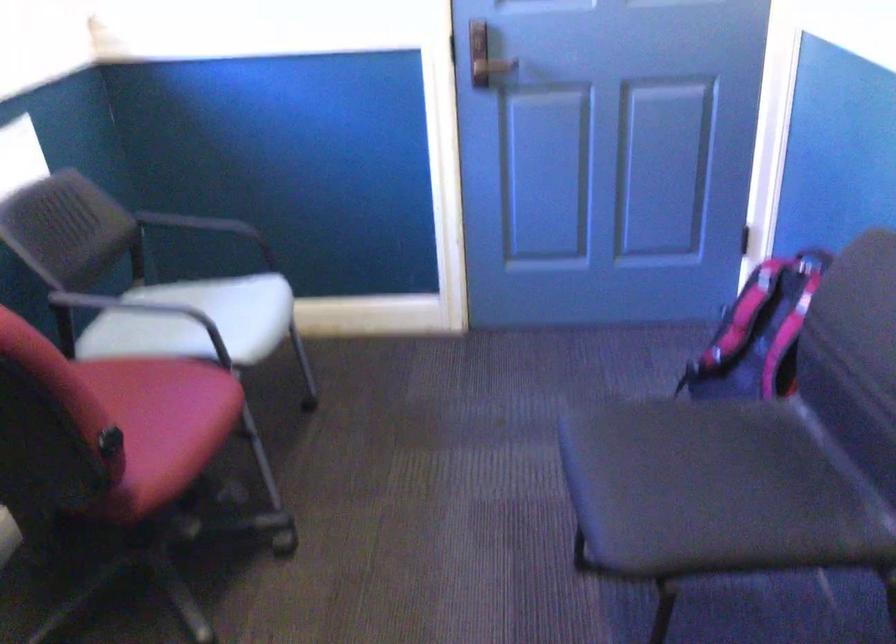
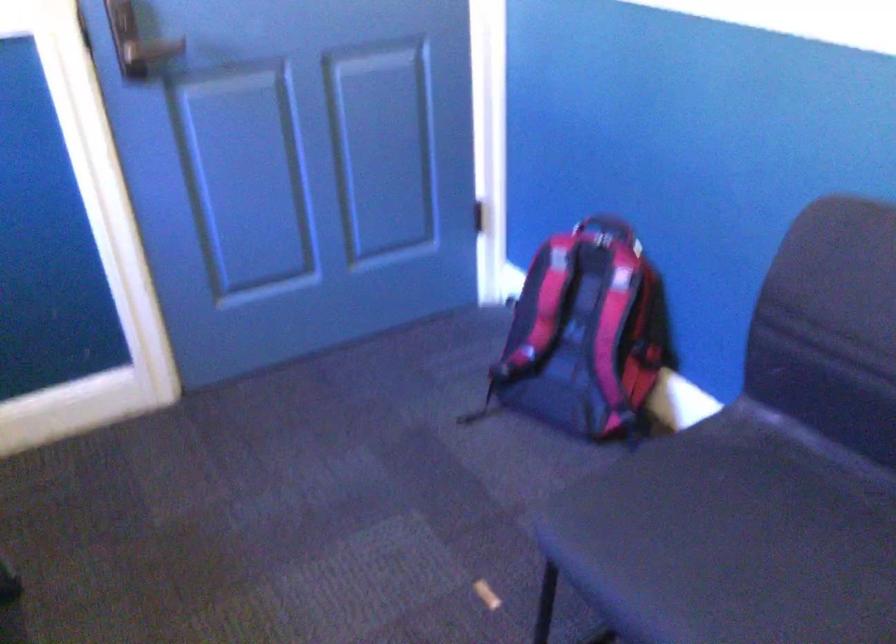
Question: How did the camera likely rotate?

Choices:
 (A) Left
 (B) Right
 (C) Up
 (D) Down

Answer: (B)